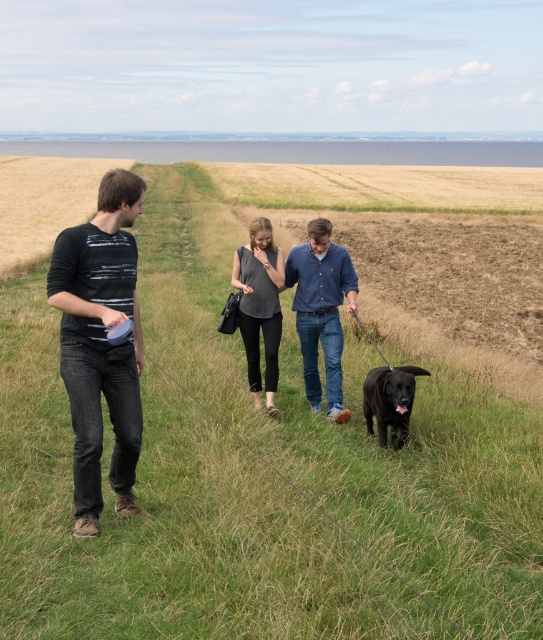
From the picture: Is dark gray striped shirt at left positioned in front of blue denim shirt at center?

Yes, it is.

Between dark gray striped shirt at left and blue denim shirt at center, which one is positioned higher?

blue denim shirt at center

You are a GUI agent. You are given a task and a screenshot of the screen. Output one action in this format:
    pyautogui.click(x=<x>, y=<y>)
    Task: Click on the dark gray striped shirt at left
    This screenshot has height=640, width=543.
    Given the screenshot: What is the action you would take?
    pyautogui.click(x=100, y=342)

Where is `dark gray striped shirt at left`? This screenshot has width=543, height=640. dark gray striped shirt at left is located at coordinates (100, 342).

Which is more to the left, dark gray striped shirt at left or black matte dog at lower center?

From the viewer's perspective, dark gray striped shirt at left appears more on the left side.

The width and height of the screenshot is (543, 640). What are the coordinates of `dark gray striped shirt at left` in the screenshot? It's located at (100, 342).

Locate an element on the screen. This screenshot has width=543, height=640. dark gray striped shirt at left is located at coordinates (x=100, y=342).

Does blue denim shirt at center appear over black matte dog at lower center?

Correct, blue denim shirt at center is located above black matte dog at lower center.

Is blue denim shirt at center further to camera compared to black matte dog at lower center?

That is True.

Does point (314, 292) come closer to viewer compared to point (382, 404)?

That is False.

Where is `blue denim shirt at center`? This screenshot has width=543, height=640. blue denim shirt at center is located at coordinates (320, 310).